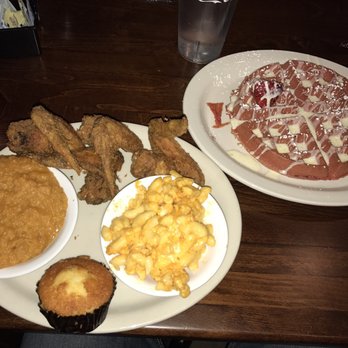
Identify the location of sugar holder. Image resolution: width=348 pixels, height=348 pixels. (21, 42).